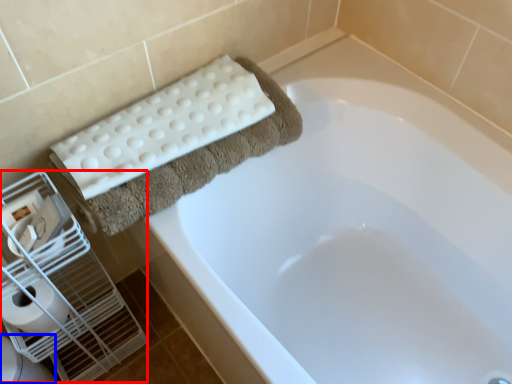
Question: Which of the following is the farthest to the observer, bird cage (highlighted by a red box) or toilet bowl (highlighted by a blue box)?

Choices:
 (A) bird cage
 (B) toilet bowl

Answer: (B)